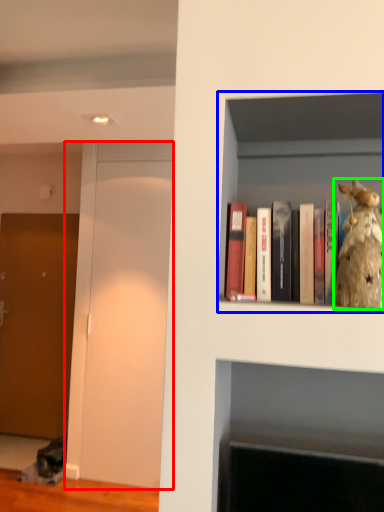
Question: Which object is positioned farthest from glass door (highlighted by a red box)? Select from shelf (highlighted by a blue box) and figurine (highlighted by a green box).

Choices:
 (A) shelf
 (B) figurine

Answer: (B)